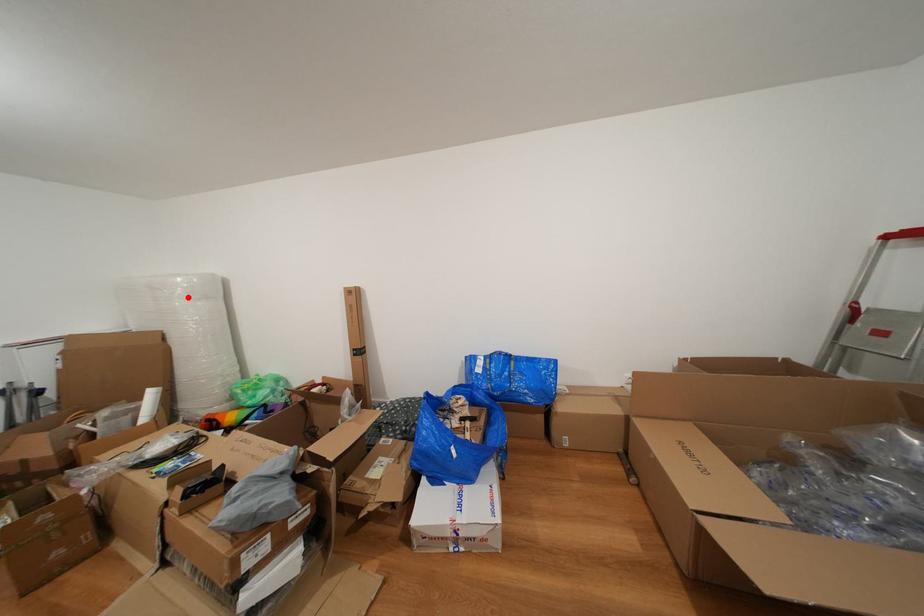
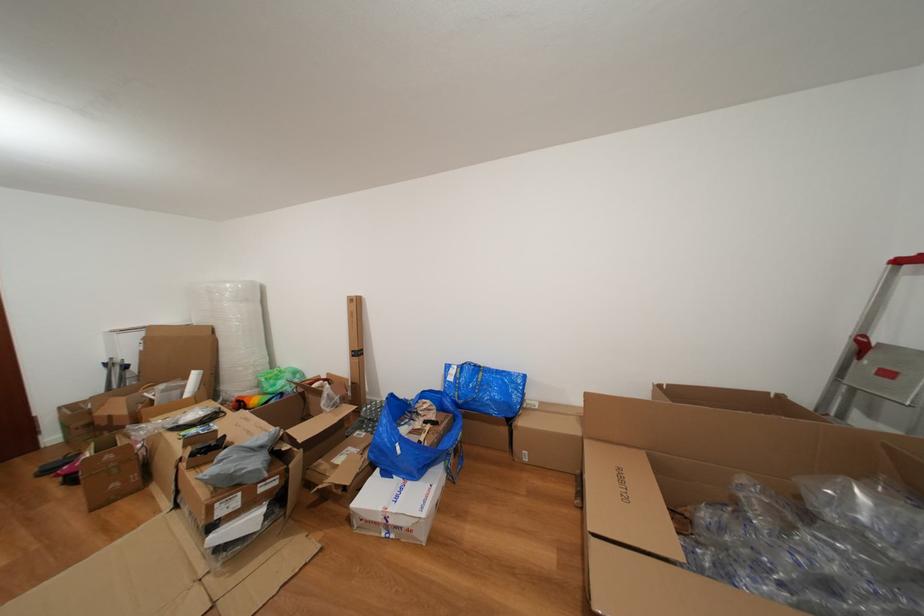
Question: I am providing you with two images of the same scene from different viewpoints. A red point is shown in image1. For the corresponding object point in image2, is it positioned nearer or farther from the camera?

Choices:
 (A) Nearer
 (B) Farther

Answer: (A)